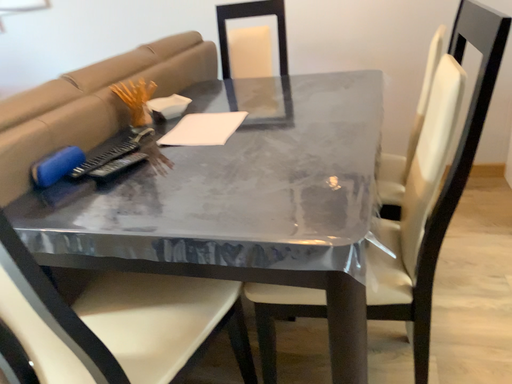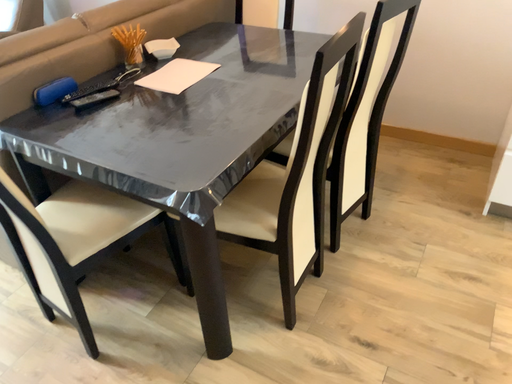
Question: How did the camera likely rotate when shooting the video?

Choices:
 (A) rotated downward
 (B) rotated upward

Answer: (A)